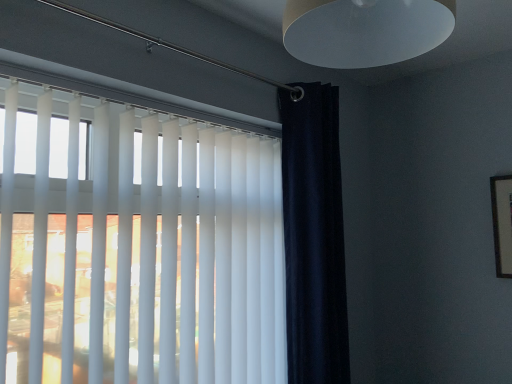
Describe the element at coordinates (314, 236) in the screenshot. I see `navy blue velvet curtain at right` at that location.

I want to click on white matte blinds at upper left, so click(141, 249).

Find the location of a particular element. Image resolution: width=512 pixels, height=384 pixels. matte white lampshade at upper center is located at coordinates (365, 30).

Considering the positions of objects white matte blinds at upper left and navy blue velvet curtain at right in the image provided, who is more to the left, white matte blinds at upper left or navy blue velvet curtain at right?

white matte blinds at upper left is more to the left.

From the image's perspective, is white matte blinds at upper left positioned above or below navy blue velvet curtain at right?

From the image's perspective, white matte blinds at upper left appears below navy blue velvet curtain at right.

Which is closer, (x=63, y=211) or (x=336, y=267)?

Point (x=63, y=211) appears to be closer to the viewer than point (x=336, y=267).

Based on the photo, are matte white lampshade at upper center and white matte blinds at upper left beside each other?

No, matte white lampshade at upper center is not in contact with white matte blinds at upper left.

Is matte white lampshade at upper center oriented away from white matte blinds at upper left?

matte white lampshade at upper center is not turned away from white matte blinds at upper left.

Is matte white lampshade at upper center in front of or behind white matte blinds at upper left in the image?

Visually, matte white lampshade at upper center is located in front of white matte blinds at upper left.

Between matte white lampshade at upper center and navy blue velvet curtain at right, which one has larger size?

Bigger between the two is navy blue velvet curtain at right.

Is matte white lampshade at upper center behind navy blue velvet curtain at right?

No, it is not.

Is there a large distance between matte white lampshade at upper center and navy blue velvet curtain at right?

No, matte white lampshade at upper center is not far from navy blue velvet curtain at right.

From their relative heights in the image, would you say navy blue velvet curtain at right is taller or shorter than matte white lampshade at upper center?

In the image, navy blue velvet curtain at right appears to be taller than matte white lampshade at upper center.

Are navy blue velvet curtain at right and matte white lampshade at upper center far apart?

No, there isn't a large distance between navy blue velvet curtain at right and matte white lampshade at upper center.

Is navy blue velvet curtain at right to the left of matte white lampshade at upper center from the viewer's perspective?

No.

Looking at this image, is navy blue velvet curtain at right facing away from white matte blinds at upper left?

No, navy blue velvet curtain at right's orientation is not away from white matte blinds at upper left.

Is navy blue velvet curtain at right positioned far away from white matte blinds at upper left?

Actually, navy blue velvet curtain at right and white matte blinds at upper left are a little close together.

From the image's perspective, is navy blue velvet curtain at right above or below white matte blinds at upper left?

Clearly, from the image's perspective, navy blue velvet curtain at right is above white matte blinds at upper left.

Which of these two, navy blue velvet curtain at right or white matte blinds at upper left, stands taller?

Standing taller between the two is navy blue velvet curtain at right.

Considering the positions of objects white matte blinds at upper left and matte white lampshade at upper center in the image provided, who is more to the right, white matte blinds at upper left or matte white lampshade at upper center?

matte white lampshade at upper center.

In the scene shown: Is white matte blinds at upper left oriented towards matte white lampshade at upper center?

Yes, white matte blinds at upper left is turned towards matte white lampshade at upper center.

Can you confirm if white matte blinds at upper left is smaller than matte white lampshade at upper center?

Incorrect, white matte blinds at upper left is not smaller in size than matte white lampshade at upper center.

From a real-world perspective, does white matte blinds at upper left sit lower than matte white lampshade at upper center?

Yes.

This screenshot has width=512, height=384. What are the coordinates of `curtain lying above the white matte blinds at upper left (from the image's perspective)` in the screenshot? It's located at (314, 236).

In order to click on window blind located on the left of matte white lampshade at upper center in this screenshot , I will do `click(141, 249)`.

Based on their spatial positions, is matte white lampshade at upper center or white matte blinds at upper left closer to navy blue velvet curtain at right?

white matte blinds at upper left is closer to navy blue velvet curtain at right.

Based on their spatial positions, is matte white lampshade at upper center or navy blue velvet curtain at right closer to white matte blinds at upper left?

The object closer to white matte blinds at upper left is navy blue velvet curtain at right.

Estimate the real-world distances between objects in this image. Which object is further from matte white lampshade at upper center, white matte blinds at upper left or navy blue velvet curtain at right?

navy blue velvet curtain at right lies further to matte white lampshade at upper center than the other object.

Which object lies nearer to the anchor point white matte blinds at upper left, navy blue velvet curtain at right or matte white lampshade at upper center?

Among the two, navy blue velvet curtain at right is located nearer to white matte blinds at upper left.

From the image, which object appears to be farther from navy blue velvet curtain at right, white matte blinds at upper left or matte white lampshade at upper center?

Among the two, matte white lampshade at upper center is located further to navy blue velvet curtain at right.

When comparing their distances from matte white lampshade at upper center, does navy blue velvet curtain at right or white matte blinds at upper left seem further?

The object further to matte white lampshade at upper center is navy blue velvet curtain at right.

Identify the location of window blind located between matte white lampshade at upper center and navy blue velvet curtain at right in the depth direction. (141, 249).